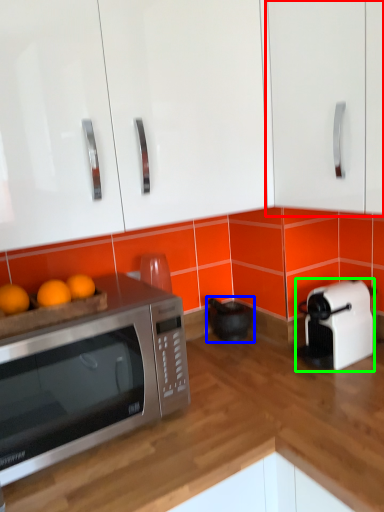
Question: Based on their relative distances, which object is nearer to cabinetry (highlighted by a red box)? Choose from appliance (highlighted by a blue box) and toaster (highlighted by a green box).

Choices:
 (A) appliance
 (B) toaster

Answer: (B)